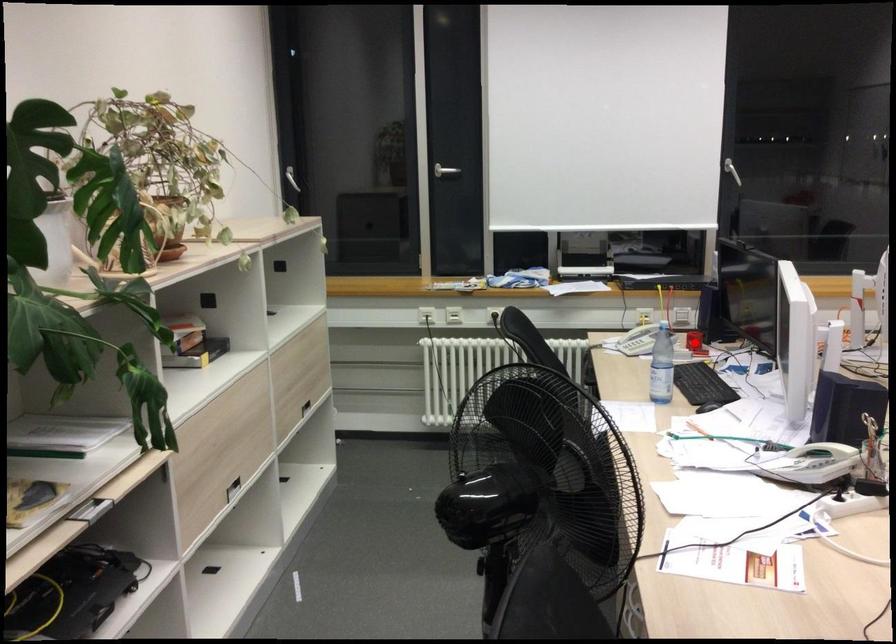
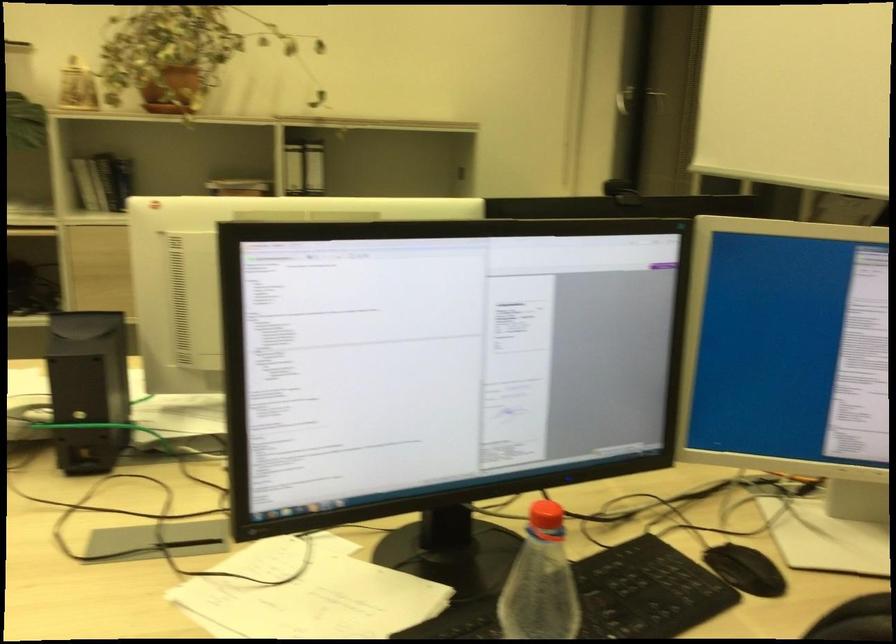
Question: I am providing you with two images of the same scene from different viewpoints. A red point is marked on the first image. Is the red point's position out of view in image 2?

Choices:
 (A) Yes
 (B) No

Answer: (A)